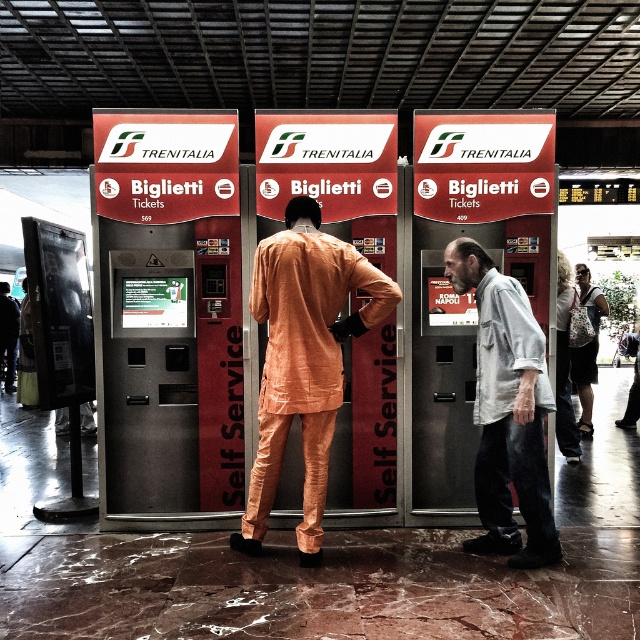
Can you confirm if red plastic vending machine at center is thinner than light gray cotton shirt at right?

In fact, red plastic vending machine at center might be wider than light gray cotton shirt at right.

The height and width of the screenshot is (640, 640). What do you see at coordinates (472, 291) in the screenshot?
I see `red plastic vending machine at center` at bounding box center [472, 291].

Is point (432, 468) positioned after point (513, 401)?

Yes.

Locate an element on the screen. The height and width of the screenshot is (640, 640). red plastic vending machine at center is located at coordinates coord(472,291).

Who is positioned more to the left, metallic silver ticket machine at center or light gray cotton shirt at right?

From the viewer's perspective, metallic silver ticket machine at center appears more on the left side.

Between point (182, 460) and point (522, 390), which one is positioned behind?

Point (182, 460)

Locate an element on the screen. metallic silver ticket machine at center is located at coordinates (170, 314).

Who is positioned more to the left, red plastic vending machine at center or orange fabric suit at center?

orange fabric suit at center is more to the left.

Is point (440, 145) closer to viewer compared to point (288, 429)?

No.

Who is more distant from viewer, (528, 272) or (307, 497)?

Point (528, 272)

Locate an element on the screen. Image resolution: width=640 pixels, height=640 pixels. red plastic vending machine at center is located at coordinates (472, 291).